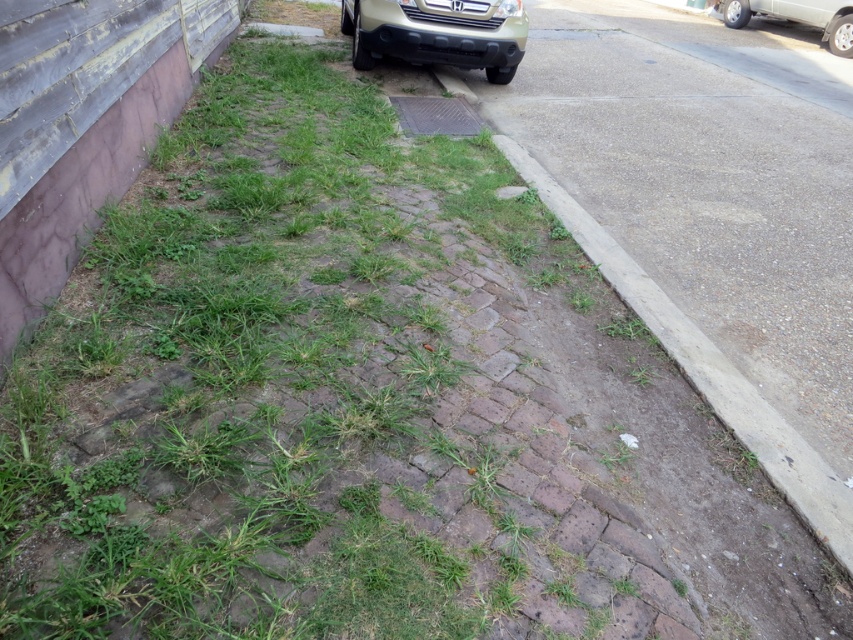
Who is taller, gold matte bumper at upper center or metallic gold suv at upper right?

Standing taller between the two is metallic gold suv at upper right.

Which is above, gold matte bumper at upper center or metallic gold suv at upper right?

metallic gold suv at upper right

Describe the element at coordinates (438, 33) in the screenshot. The height and width of the screenshot is (640, 853). I see `gold matte bumper at upper center` at that location.

The height and width of the screenshot is (640, 853). What are the coordinates of `gold matte bumper at upper center` in the screenshot? It's located at (438, 33).

Based on the photo, is dull gray concrete at center taller than gold matte bumper at upper center?

Yes.

Between dull gray concrete at center and gold matte bumper at upper center, which one has less height?

Standing shorter between the two is gold matte bumper at upper center.

Find the location of a particular element. This screenshot has width=853, height=640. dull gray concrete at center is located at coordinates (709, 212).

Locate an element on the screen. dull gray concrete at center is located at coordinates pyautogui.click(x=709, y=212).

Between metallic gold suv at upper right and metallic grid cover at center, which one appears on the left side from the viewer's perspective?

metallic grid cover at center

Which is above, metallic gold suv at upper right or metallic grid cover at center?

metallic gold suv at upper right is above.

Identify the location of metallic gold suv at upper right. The width and height of the screenshot is (853, 640). (799, 17).

Image resolution: width=853 pixels, height=640 pixels. What are the coordinates of `metallic gold suv at upper right` in the screenshot? It's located at (799, 17).